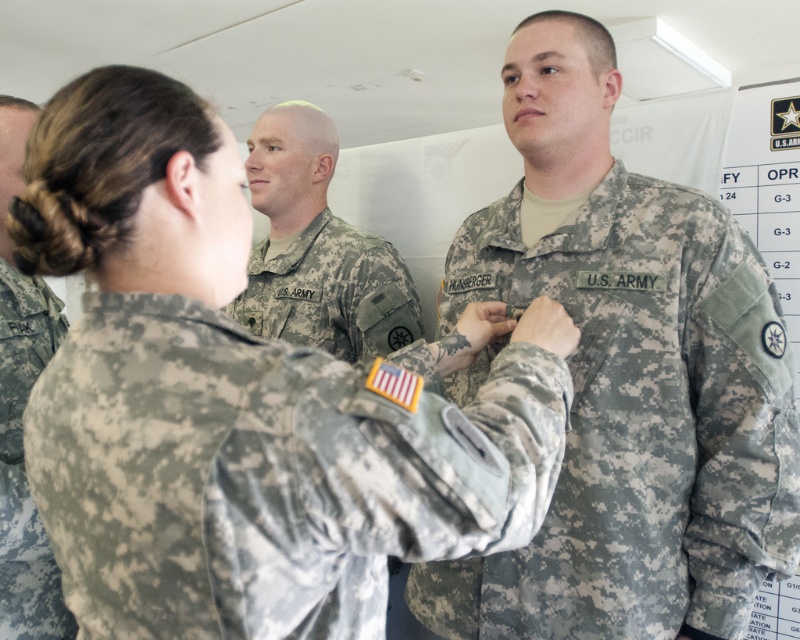
Question: Among these points, which one is farthest from the camera?

Choices:
 (A) pyautogui.click(x=533, y=540)
 (B) pyautogui.click(x=152, y=602)

Answer: (A)

Question: Can you confirm if camouflage fabric us army uniform at center is positioned to the right of camouflage uniform at center?

Choices:
 (A) yes
 (B) no

Answer: (A)

Question: Is camouflage fabric at center to the left of camouflage fabric us army uniform at center from the viewer's perspective?

Choices:
 (A) yes
 (B) no

Answer: (A)

Question: In this image, where is camouflage fabric at center located relative to camouflage fabric us army uniform at center?

Choices:
 (A) above
 (B) below

Answer: (A)

Question: Among these objects, which one is farthest from the camera?

Choices:
 (A) camouflage fabric at center
 (B) camouflage uniform at center

Answer: (B)

Question: Which object appears closest to the camera in this image?

Choices:
 (A) camouflage fabric us army uniform at center
 (B) camouflage fabric at center

Answer: (B)